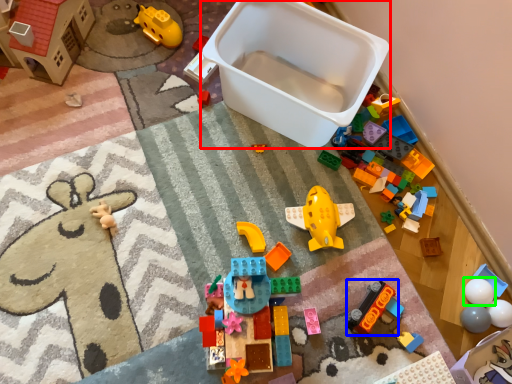
Question: Which is nearer to the storage box (highlighted by a red box)? toy (highlighted by a blue box) or toy (highlighted by a green box).

Choices:
 (A) toy
 (B) toy

Answer: (A)